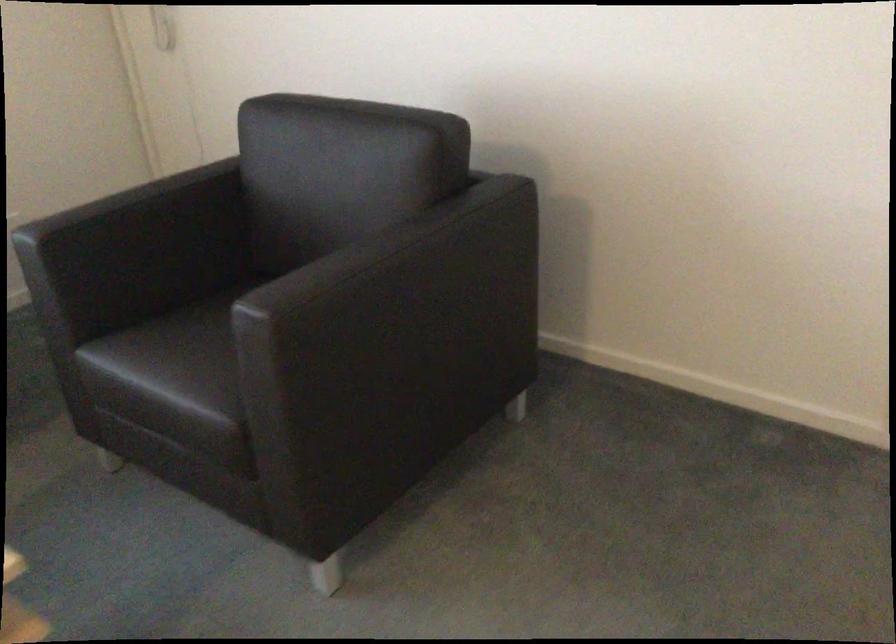
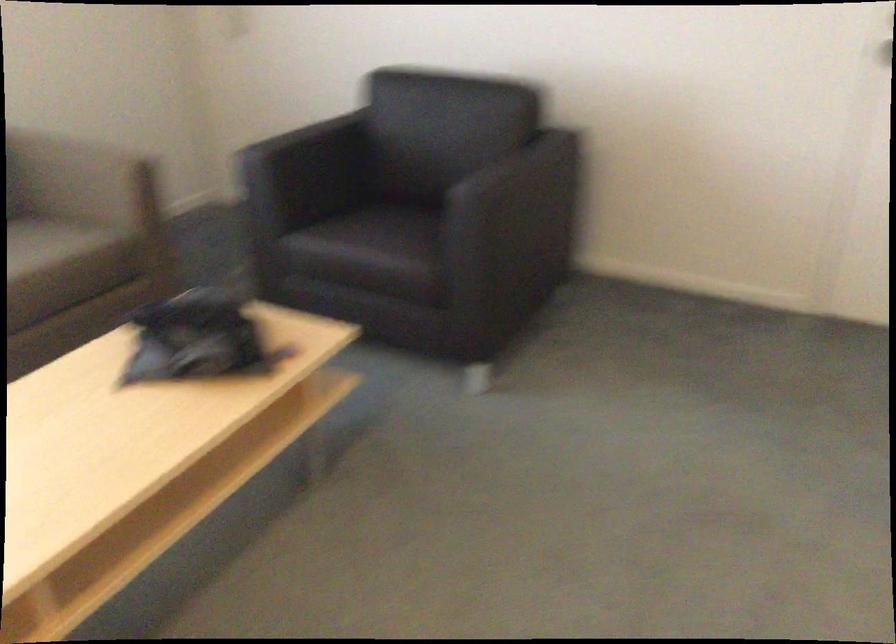
The point at (115, 214) is marked in the first image. Where is the corresponding point in the second image?

(304, 138)